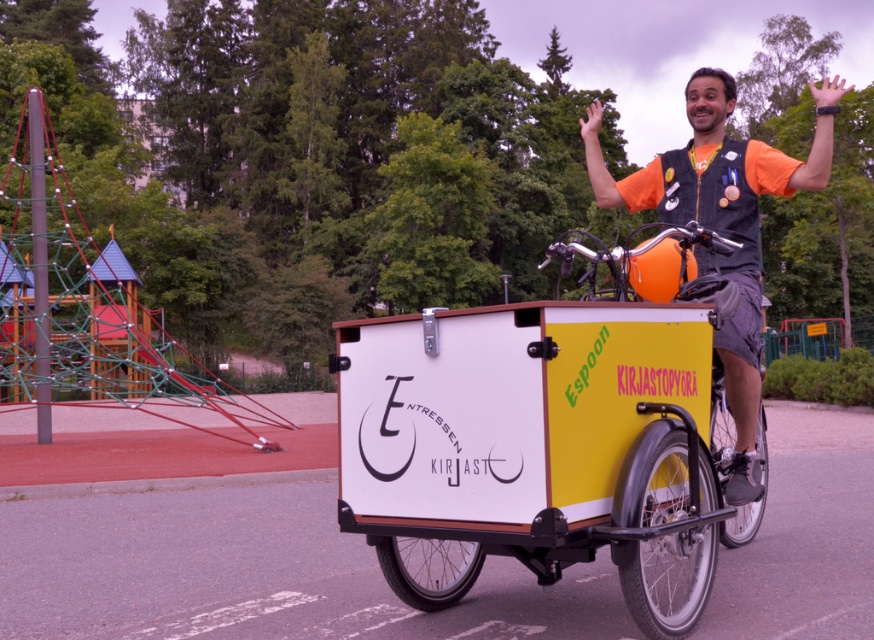
Question: Which object is the farthest from the yellow matte cargo bike at center?

Choices:
 (A) white matte cargo bike at center
 (B) orange fabric vest at upper center

Answer: (B)

Question: Where is white matte cargo bike at center located in relation to orange fabric vest at upper center in the image?

Choices:
 (A) right
 (B) left

Answer: (B)

Question: Can you confirm if white matte cargo bike at center is positioned below orange fabric vest at upper center?

Choices:
 (A) no
 (B) yes

Answer: (B)

Question: Does white matte cargo bike at center appear on the left side of yellow matte cargo bike at center?

Choices:
 (A) yes
 (B) no

Answer: (A)

Question: Estimate the real-world distances between objects in this image. Which object is farther from the orange fabric vest at upper center?

Choices:
 (A) white matte cargo bike at center
 (B) yellow matte cargo bike at center

Answer: (A)

Question: Which object is closer to the camera taking this photo?

Choices:
 (A) yellow matte cargo bike at center
 (B) orange fabric vest at upper center
 (C) white matte cargo bike at center

Answer: (C)